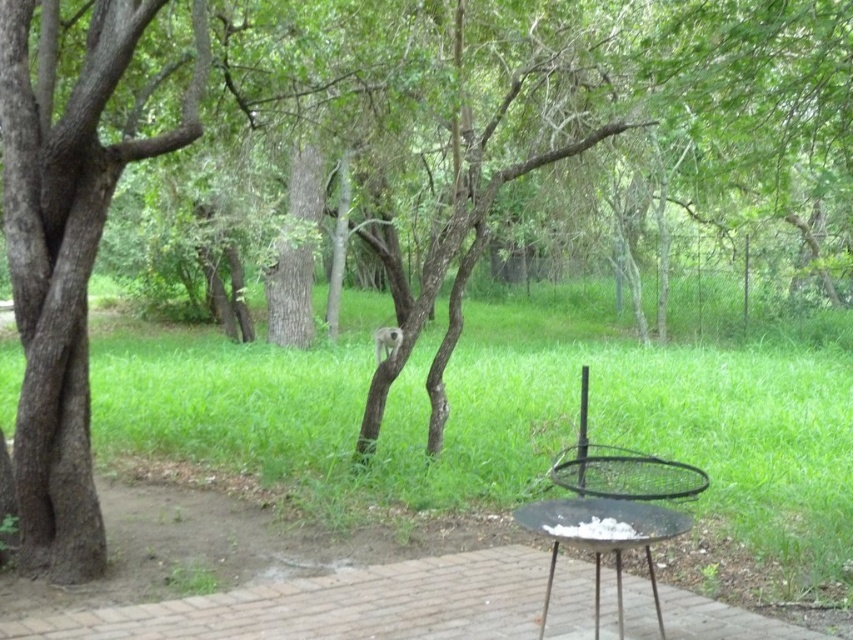
Based on the photo, you are standing on the paved area and want to place a picnic blanket near the smooth brown tree trunk at left. Based on the coordinates provided in the description, can you determine the direction you should walk from the grill to reach the tree trunk?

The smooth brown tree trunk at left is located at point coordinates, so you should walk towards the left side from the grill to reach it.

You are planning to set up a picnic blanket in the green grass at center. Considering the size of the black metal grill at lower right, will there be enough space for a standard picnic blanket that measures 1.5 meters by 2 meters?

The green grass at center is bigger than the black metal grill at lower right. Since the grass area is larger, there should be sufficient space to accommodate a standard picnic blanket measuring 1.5 meters by 2 meters.

You are standing in the backyard and want to move from the smooth brown tree trunk at left to the black metal grill at lower right. Which direction should you move to reach the grill?

The smooth brown tree trunk at left is positioned on the left side of the black metal grill at lower right, so you should move to the right to reach the grill.